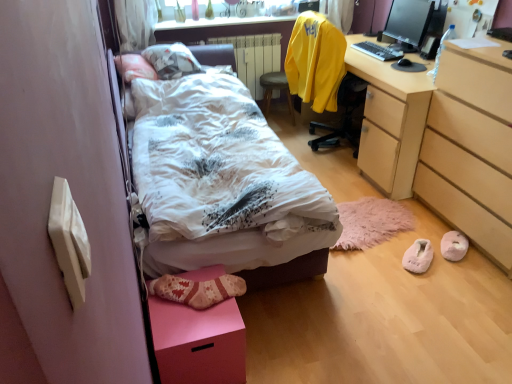
Measure the distance between wooden stool at center and camera.

A distance of 3.77 meters exists between wooden stool at center and camera.

Where is `white painted metal radiator at center`? This screenshot has width=512, height=384. white painted metal radiator at center is located at coordinates (254, 57).

The height and width of the screenshot is (384, 512). Describe the element at coordinates (223, 189) in the screenshot. I see `white soft bed at center` at that location.

Image resolution: width=512 pixels, height=384 pixels. Identify the location of wooden stool at center. (276, 89).

Between point (408, 253) and point (463, 253), which one is positioned in front?

The point (463, 253) is closer.

Is white fluffy slippers at lower right, which is counted as the 2th footwear, starting from the right, in contact with peachy suede slippers at lower right, which is the first footwear in right-to-left order?

white fluffy slippers at lower right, which is counted as the 2th footwear, starting from the right, and peachy suede slippers at lower right, which is the first footwear in right-to-left order, are not in contact.

In the scene shown: Measure the distance between white fluffy slippers at lower right, the 1th footwear viewed from the left, and peachy suede slippers at lower right, which is the first footwear in right-to-left order.

5.68 inches.

Find the location of a particular element. The width and height of the screenshot is (512, 384). footwear in front of the peachy suede slippers at lower right, which is the 2th footwear in left-to-right order is located at coordinates point(418,256).

Identify the location of bed above the white painted metal radiator at center (from a real-world perspective). (223, 189).

Considering the sizes of white painted metal radiator at center and white soft bed at center in the image, is white painted metal radiator at center taller or shorter than white soft bed at center?

Considering their sizes, white painted metal radiator at center has more height than white soft bed at center.

Does white painted metal radiator at center have a greater width compared to white soft bed at center?

No.

Is white painted metal radiator at center turned away from white soft bed at center?

white painted metal radiator at center does not have its back to white soft bed at center.

Can you confirm if wooden stool at center is positioned to the left of yellow fabric chair at upper right?

Indeed, wooden stool at center is positioned on the left side of yellow fabric chair at upper right.

From the image's perspective, which object appears higher, wooden stool at center or yellow fabric chair at upper right?

wooden stool at center.

Could you tell me if wooden stool at center is turned towards yellow fabric chair at upper right?

Yes, wooden stool at center faces towards yellow fabric chair at upper right.

Who is taller, matte black monitor at upper right or yellow fabric chair at upper right?

yellow fabric chair at upper right is taller.

Considering the sizes of matte black monitor at upper right and yellow fabric chair at upper right in the image, is matte black monitor at upper right bigger or smaller than yellow fabric chair at upper right?

Clearly, matte black monitor at upper right is smaller in size than yellow fabric chair at upper right.

Can you confirm if matte black monitor at upper right is positioned to the left of yellow fabric chair at upper right?

No, matte black monitor at upper right is not to the left of yellow fabric chair at upper right.

The height and width of the screenshot is (384, 512). Identify the location of computer monitor that is above the yellow fabric chair at upper right (from a real-world perspective). (408, 24).

Based on the photo, between white soft bed at center and light brown wood chest of drawers at lower right, which one has smaller size?

Smaller between the two is light brown wood chest of drawers at lower right.

Can you confirm if white soft bed at center is thinner than light brown wood chest of drawers at lower right?

In fact, white soft bed at center might be wider than light brown wood chest of drawers at lower right.

From a real-world perspective, who is located higher, white soft bed at center or light brown wood chest of drawers at lower right?

white soft bed at center.

From a real-world perspective, is matte black monitor at upper right on white soft bed at center?

Yes.

Is matte black monitor at upper right inside or outside of white soft bed at center?

matte black monitor at upper right exists outside the volume of white soft bed at center.

Which object is closer to the camera taking this photo, matte black monitor at upper right or white soft bed at center?

white soft bed at center is more forward.

Is white soft bed at center at the back of wooden stool at center?

wooden stool at center does not have its back to white soft bed at center.

From the image's perspective, does wooden stool at center appear higher than white soft bed at center?

Yes, from the image's perspective, wooden stool at center is on top of white soft bed at center.

From a real-world perspective, is wooden stool at center over white soft bed at center?

No, from a real-world perspective, wooden stool at center is not above white soft bed at center.

Identify the location of footwear that appears below the white fluffy slippers at lower right, which is counted as the 2th footwear, starting from the right (from a real-world perspective). The width and height of the screenshot is (512, 384). (454, 246).

Locate an element on the screen. Image resolution: width=512 pixels, height=384 pixels. bed above the white painted metal radiator at center (from a real-world perspective) is located at coordinates (223, 189).

From the image, which object appears to be nearer to white fluffy slippers at lower right, the 1th footwear viewed from the left, light brown wood chest of drawers at lower right or wooden stool at center?

light brown wood chest of drawers at lower right lies closer to white fluffy slippers at lower right, the 1th footwear viewed from the left, than the other object.

From the image, which object appears to be farther from wooden stool at center, pink matte shoe box at lower left or yellow fabric chair at upper right?

The object further to wooden stool at center is pink matte shoe box at lower left.

Considering their positions, is pink matte shoe box at lower left positioned further to peachy suede slippers at lower right, which is the first footwear in right-to-left order, than white soft bed at center?

pink matte shoe box at lower left is further to peachy suede slippers at lower right, which is the first footwear in right-to-left order.

When comparing their distances from white fluffy slippers at lower right, the 1th footwear viewed from the left, does yellow fabric chair at upper right or peachy suede slippers at lower right, which is the 2th footwear in left-to-right order, seem further?

The object further to white fluffy slippers at lower right, the 1th footwear viewed from the left, is yellow fabric chair at upper right.

From the image, which object appears to be farther from yellow fabric chair at upper right, white painted metal radiator at center or pink matte shoe box at lower left?

pink matte shoe box at lower left.

Estimate the real-world distances between objects in this image. Which object is closer to light brown wood chest of drawers at lower right, yellow fabric chair at upper right or matte black monitor at upper right?

yellow fabric chair at upper right lies closer to light brown wood chest of drawers at lower right than the other object.

When comparing their distances from light brown wood chest of drawers at lower right, does yellow fabric chair at upper right or peachy suede slippers at lower right, which is the first footwear in right-to-left order, seem closer?

peachy suede slippers at lower right, which is the first footwear in right-to-left order, lies closer to light brown wood chest of drawers at lower right than the other object.

Looking at the image, which one is located closer to peachy suede slippers at lower right, which is the 2th footwear in left-to-right order, matte black monitor at upper right or white soft bed at center?

white soft bed at center is positioned closer to the anchor peachy suede slippers at lower right, which is the 2th footwear in left-to-right order.

Identify the location of bed between matte black monitor at upper right and pink matte shoe box at lower left from top to bottom. The height and width of the screenshot is (384, 512). pos(223,189).

Identify the location of chair located between white soft bed at center and peachy suede slippers at lower right, which is the 2th footwear in left-to-right order, in the left-right direction. The image size is (512, 384). (322, 74).

At what (x,y) coordinates should I click in order to perform the action: click on computer monitor located between white soft bed at center and wooden stool at center in the depth direction. Please return your answer as a coordinate pair (x, y). The image size is (512, 384). Looking at the image, I should click on (408, 24).

You are a GUI agent. You are given a task and a screenshot of the screen. Output one action in this format:
    pyautogui.click(x=<x>, y=<y>)
    Task: Click on the chair positioned between white soft bed at center and white painted metal radiator at center from near to far
    
    Given the screenshot: What is the action you would take?
    pyautogui.click(x=322, y=74)